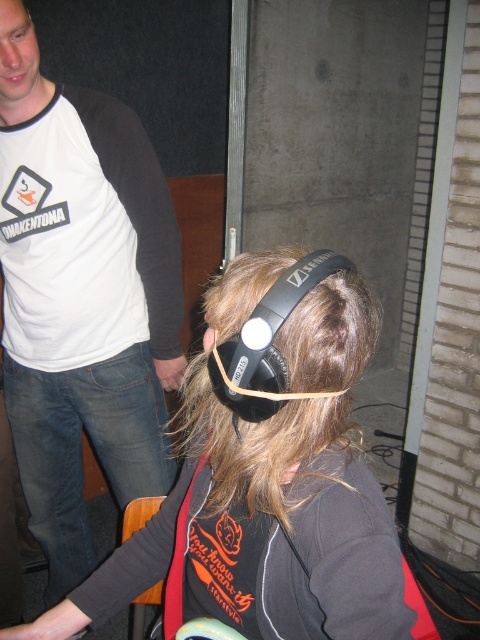
Question: Is black matte headphones at center further to the viewer compared to white cotton t-shirt at upper left?

Choices:
 (A) yes
 (B) no

Answer: (B)

Question: Which is nearer to the black matte headphones at center?

Choices:
 (A) black matte headphones at upper center
 (B) white cotton t-shirt at upper left

Answer: (A)

Question: From the image, what is the correct spatial relationship of white cotton t-shirt at upper left in relation to black matte headphones at upper center?

Choices:
 (A) below
 (B) above

Answer: (A)

Question: Does black matte headphones at center have a larger size compared to white cotton t-shirt at upper left?

Choices:
 (A) no
 (B) yes

Answer: (A)

Question: Which point is closer to the camera?

Choices:
 (A) white cotton t-shirt at upper left
 (B) black matte headphones at center

Answer: (B)

Question: Among these objects, which one is nearest to the camera?

Choices:
 (A) white cotton t-shirt at upper left
 (B) black matte headphones at center

Answer: (B)